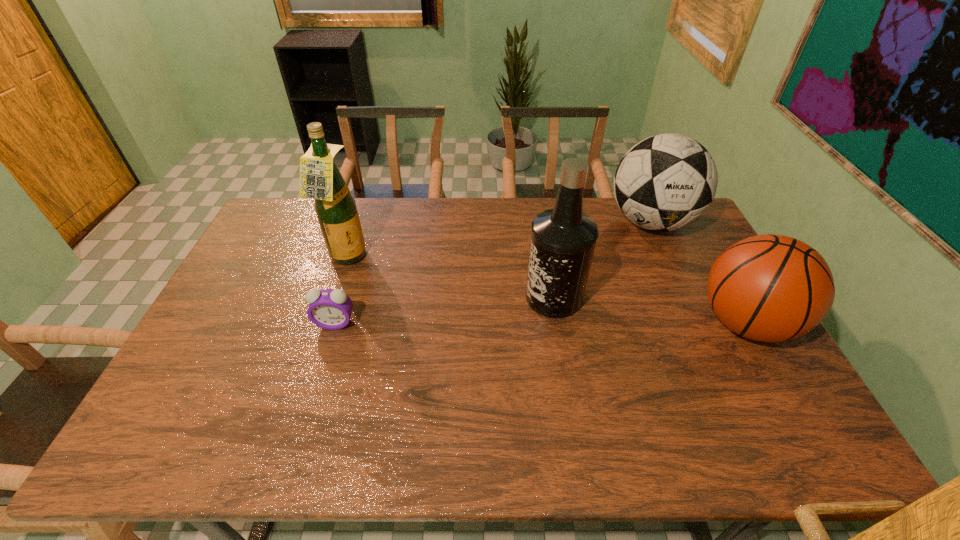
Where is `object situated at the far right corner`? The height and width of the screenshot is (540, 960). object situated at the far right corner is located at coordinates point(665,182).

This screenshot has height=540, width=960. I want to click on free space at the far edge of the desktop, so click(379, 220).

In the image, there is a desktop. Identify the location of free space at the near edge. (343, 388).

Locate an element on the screen. This screenshot has width=960, height=540. vacant space at the left edge of the desktop is located at coordinates (196, 341).

In the image, there is a desktop. Identify the location of free space at the far left corner. The height and width of the screenshot is (540, 960). (293, 214).

This screenshot has height=540, width=960. Find the location of `unoccupied area between the left liquor and the soccer ball`. unoccupied area between the left liquor and the soccer ball is located at coordinates (499, 240).

Image resolution: width=960 pixels, height=540 pixels. I want to click on vacant space in between the basketball and the nearer liquor, so click(649, 310).

Locate an element on the screen. free space that is in between the third object from right to left and the farther liquor is located at coordinates (450, 278).

What are the coordinates of `vacant area between the basketball and the alarm clock` in the screenshot? It's located at [x=540, y=323].

What are the coordinates of `unoccupied position between the alarm clock and the third object from left to right` in the screenshot? It's located at (444, 310).